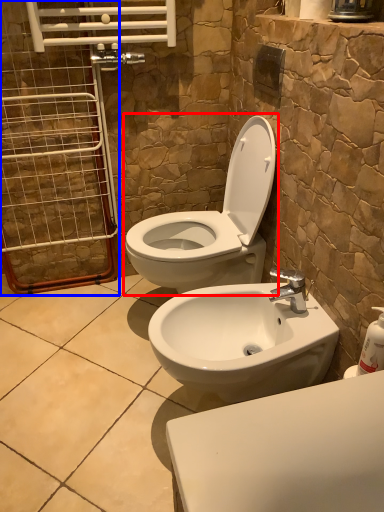
Question: Which of the following is the closest to the observer, toilet (highlighted by a red box) or screen door (highlighted by a blue box)?

Choices:
 (A) toilet
 (B) screen door

Answer: (A)